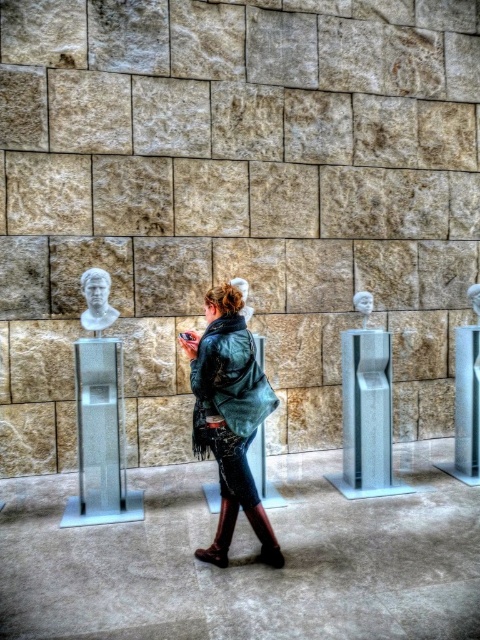
Does green leather jacket at center have a larger size compared to brown leather boot at lower center?

Correct, green leather jacket at center is larger in size than brown leather boot at lower center.

Does green leather jacket at center have a greater width compared to brown leather boot at lower center?

Yes.

Does point (204, 432) lie in front of point (256, 518)?

Yes, it is.

Find the location of a particular element. Image resolution: width=480 pixels, height=640 pixels. green leather jacket at center is located at coordinates (228, 384).

Is point (87, 417) behind point (98, 296)?

No, (87, 417) is closer to viewer.

Is metallic polished column at center to the left of white marble bust at center from the viewer's perspective?

Indeed, metallic polished column at center is positioned on the left side of white marble bust at center.

Who is more distant from viewer, (120, 362) or (96, 336)?

The point (96, 336) is behind.

Image resolution: width=480 pixels, height=640 pixels. I want to click on metallic polished column at center, so click(99, 426).

Does leather jacket at center lie behind brown leather boot at center?

No, it is in front of brown leather boot at center.

Does leather jacket at center appear under brown leather boot at center?

Incorrect, leather jacket at center is not positioned below brown leather boot at center.

Does point (214, 449) come farther from viewer compared to point (214, 541)?

No, (214, 449) is in front of (214, 541).

Find the location of `leather jacket at center`. leather jacket at center is located at coordinates (229, 417).